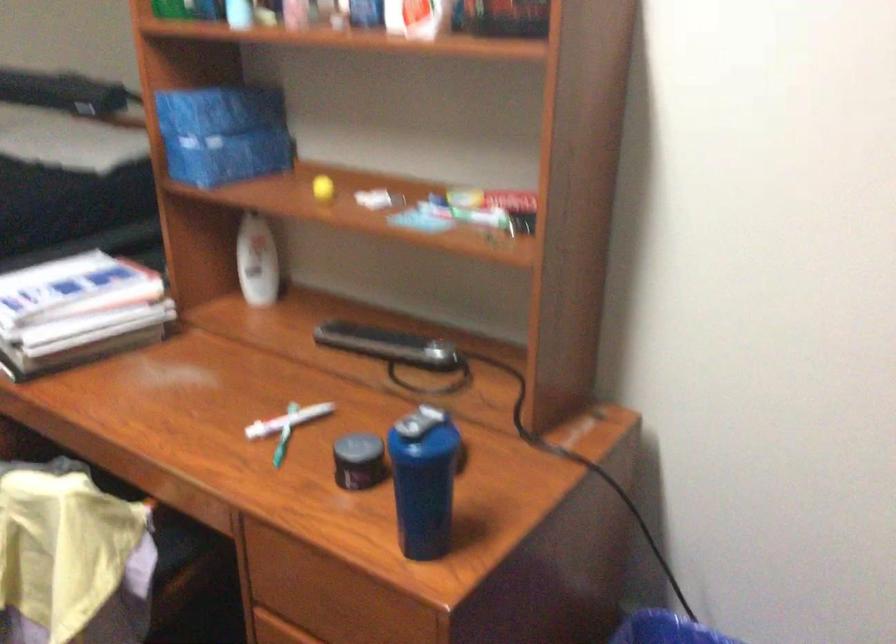
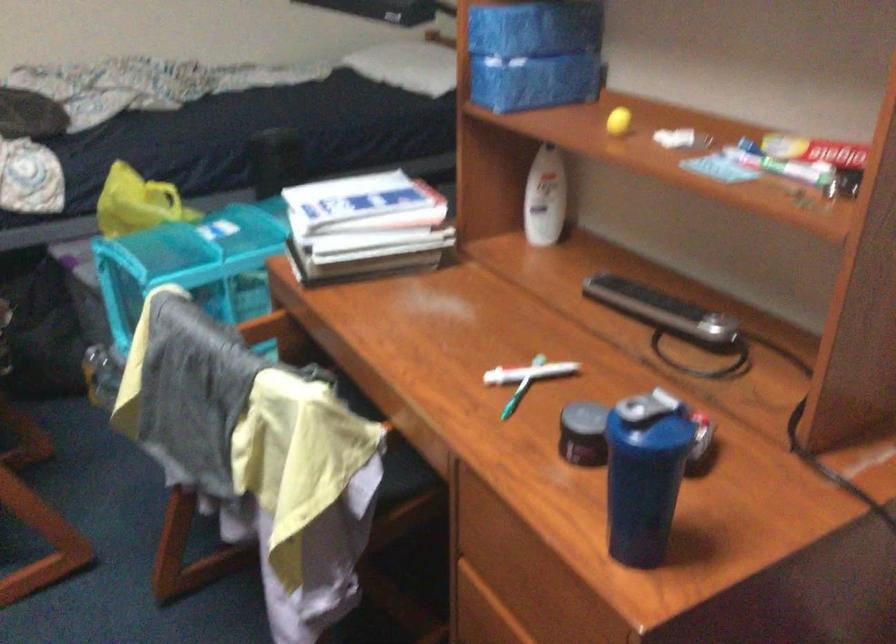
The point at (247, 214) is marked in the first image. Where is the corresponding point in the second image?

(541, 147)